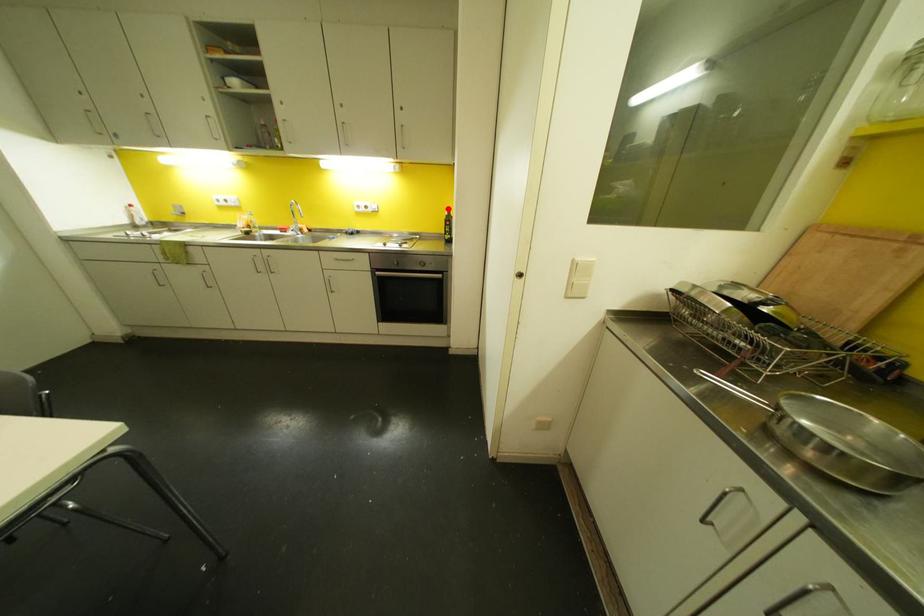
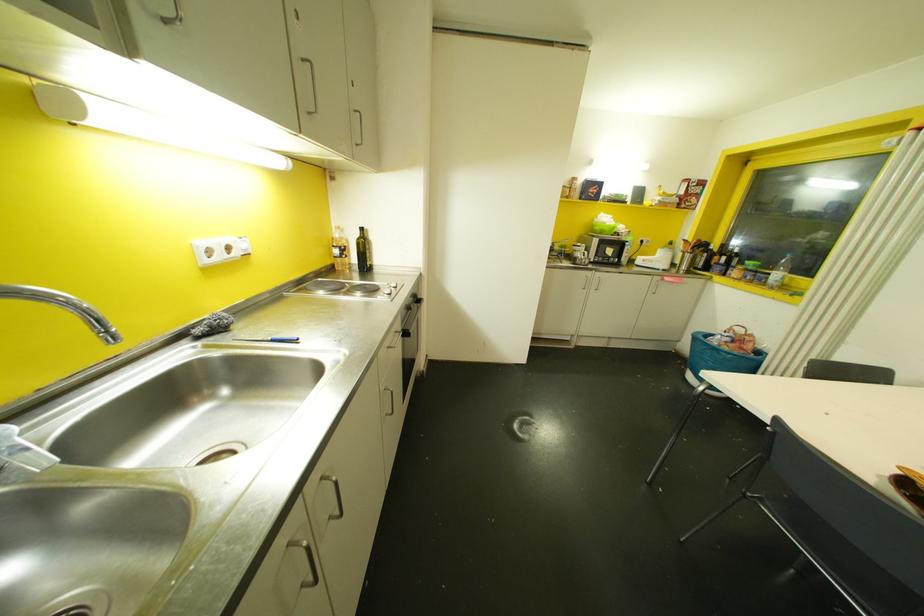
Find the pixel in the second image that matches the highlighted location in the first image.

(360, 229)